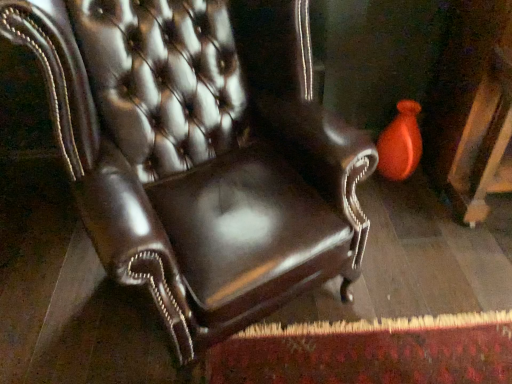
This screenshot has height=384, width=512. Describe the element at coordinates (201, 152) in the screenshot. I see `shiny leather chair at center` at that location.

In order to face shiny leather chair at center, should I rotate leftwards or rightwards?

You should look left and rotate roughly 5.253 degrees.

Locate an element on the screen. shiny leather chair at center is located at coordinates point(201,152).

Measure the distance between shiny leather chair at center and camera.

32.01 inches.

Measure the distance between orange glossy vase at upper right and camera.

orange glossy vase at upper right is 5.86 feet from camera.

Describe the element at coordinates (400, 143) in the screenshot. I see `orange glossy vase at upper right` at that location.

The height and width of the screenshot is (384, 512). What are the coordinates of `orange glossy vase at upper right` in the screenshot? It's located at (400, 143).

In order to face orange glossy vase at upper right, should I rotate leftwards or rightwards?

Turn right approximately 18.826 degrees to face it.

Locate an element on the screen. This screenshot has width=512, height=384. shiny leather chair at center is located at coordinates (201, 152).

Considering the positions of objects shiny leather chair at center and orange glossy vase at upper right in the image provided, who is more to the right, shiny leather chair at center or orange glossy vase at upper right?

orange glossy vase at upper right is more to the right.

Who is more distant, shiny leather chair at center or orange glossy vase at upper right?

Positioned behind is orange glossy vase at upper right.

Which point is more distant from viewer, (68, 157) or (402, 124)?

Positioned behind is point (402, 124).

From the image's perspective, is shiny leather chair at center on orange glossy vase at upper right?

Incorrect, from the image's perspective, shiny leather chair at center is lower than orange glossy vase at upper right.

From a real-world perspective, does shiny leather chair at center stand above orange glossy vase at upper right?

Correct, in the physical world, shiny leather chair at center is higher than orange glossy vase at upper right.

Considering the relative sizes of shiny leather chair at center and orange glossy vase at upper right in the image provided, is shiny leather chair at center wider than orange glossy vase at upper right?

Yes.

Considering the relative sizes of shiny leather chair at center and orange glossy vase at upper right in the image provided, is shiny leather chair at center taller than orange glossy vase at upper right?

Indeed, shiny leather chair at center has a greater height compared to orange glossy vase at upper right.

Who is bigger, shiny leather chair at center or orange glossy vase at upper right?

With larger size is shiny leather chair at center.

Can orange glossy vase at upper right be found inside shiny leather chair at center?

No, orange glossy vase at upper right is not a part of shiny leather chair at center.

Is shiny leather chair at center beside orange glossy vase at upper right?

No, shiny leather chair at center is not next to orange glossy vase at upper right.

Is shiny leather chair at center looking in the opposite direction of orange glossy vase at upper right?

No, orange glossy vase at upper right is not at the back of shiny leather chair at center.

This screenshot has height=384, width=512. Identify the location of chair in front of the orange glossy vase at upper right. (201, 152).

Is orange glossy vase at upper right at the right side of shiny leather chair at center?

Yes.

Is orange glossy vase at upper right in front of or behind shiny leather chair at center in the image?

orange glossy vase at upper right is positioned farther from the viewer than shiny leather chair at center.

Between point (416, 153) and point (340, 243), which one is positioned in front?

The point (340, 243) is closer to the camera.

From the image's perspective, is orange glossy vase at upper right below shiny leather chair at center?

No, from the image's perspective, orange glossy vase at upper right is not beneath shiny leather chair at center.

From a real-world perspective, which is physically below, orange glossy vase at upper right or shiny leather chair at center?

From a 3D spatial view, orange glossy vase at upper right is below.

Considering the sizes of objects orange glossy vase at upper right and shiny leather chair at center in the image provided, who is wider, orange glossy vase at upper right or shiny leather chair at center?

Wider between the two is shiny leather chair at center.

Between orange glossy vase at upper right and shiny leather chair at center, which one has more height?

shiny leather chair at center is taller.

Based on the photo, does orange glossy vase at upper right have a larger size compared to shiny leather chair at center?

No, orange glossy vase at upper right is not bigger than shiny leather chair at center.

Is orange glossy vase at upper right not within shiny leather chair at center?

Yes.

Based on the photo, is orange glossy vase at upper right directly adjacent to shiny leather chair at center?

No, orange glossy vase at upper right is not in contact with shiny leather chair at center.

Is orange glossy vase at upper right looking in the opposite direction of shiny leather chair at center?

No, shiny leather chair at center is not at the back of orange glossy vase at upper right.

How different are the orientations of orange glossy vase at upper right and shiny leather chair at center in degrees?

28.9 degrees.

Where is `chair that appears above the orange glossy vase at upper right (from a real-world perspective)`? The width and height of the screenshot is (512, 384). chair that appears above the orange glossy vase at upper right (from a real-world perspective) is located at coordinates (201, 152).

The width and height of the screenshot is (512, 384). In order to click on vase above the shiny leather chair at center (from the image's perspective) in this screenshot , I will do `click(400, 143)`.

At what (x,y) coordinates should I click in order to perform the action: click on vase located underneath the shiny leather chair at center (from a real-world perspective). Please return your answer as a coordinate pair (x, y). This screenshot has height=384, width=512. Looking at the image, I should click on click(400, 143).